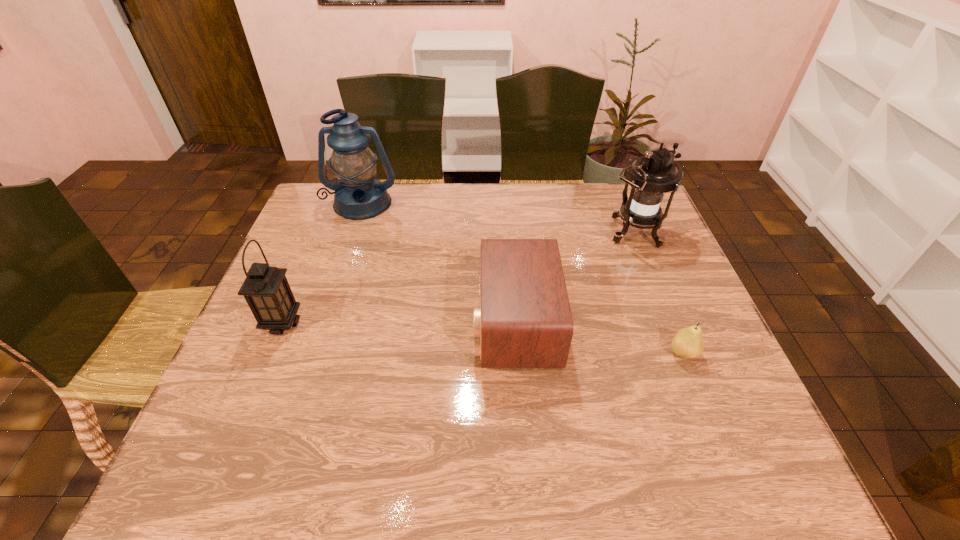
Image resolution: width=960 pixels, height=540 pixels. What are the coordinates of `free spot that satisfies the following two spatial constraints: 1. on the front panel of the pear; 2. on the right side of the radio receiver` in the screenshot? It's located at (517, 353).